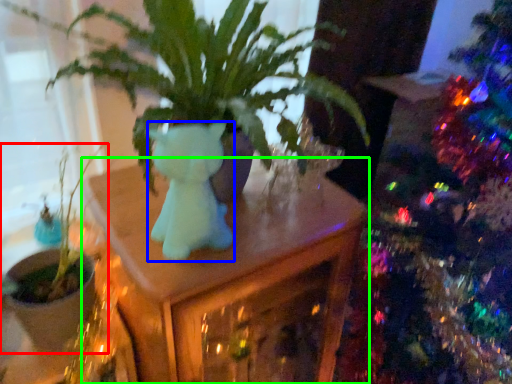
Question: Which object is the closest to the houseplant (highlighted by a red box)? Choose among these: animal (highlighted by a blue box) or table (highlighted by a green box).

Choices:
 (A) animal
 (B) table

Answer: (B)